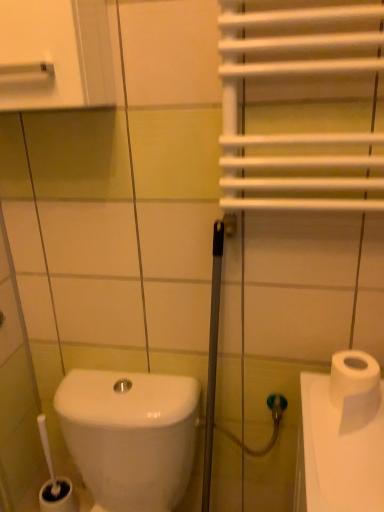
Question: Does white glossy toilet at lower left turn towards white glossy medicine cabinet at upper left?

Choices:
 (A) yes
 (B) no

Answer: (B)

Question: From a real-world perspective, is white glossy toilet at lower left positioned over white glossy medicine cabinet at upper left based on gravity?

Choices:
 (A) yes
 (B) no

Answer: (B)

Question: Does white glossy toilet at lower left have a lesser height compared to white glossy medicine cabinet at upper left?

Choices:
 (A) yes
 (B) no

Answer: (B)

Question: From the image's perspective, is white glossy toilet at lower left on top of white glossy medicine cabinet at upper left?

Choices:
 (A) yes
 (B) no

Answer: (B)

Question: Is white glossy toilet at lower left looking in the opposite direction of white glossy medicine cabinet at upper left?

Choices:
 (A) no
 (B) yes

Answer: (A)

Question: Is white glossy toilet at lower left positioned far away from white glossy medicine cabinet at upper left?

Choices:
 (A) yes
 (B) no

Answer: (B)

Question: Is white glossy toilet at lower left outside white matte toilet paper at right?

Choices:
 (A) yes
 (B) no

Answer: (A)

Question: Is white glossy toilet at lower left facing away from white matte toilet paper at right?

Choices:
 (A) yes
 (B) no

Answer: (B)

Question: Is white glossy toilet at lower left facing towards white matte toilet paper at right?

Choices:
 (A) yes
 (B) no

Answer: (B)

Question: From a real-world perspective, is white glossy toilet at lower left positioned over white matte toilet paper at right based on gravity?

Choices:
 (A) no
 (B) yes

Answer: (A)

Question: Considering the relative sizes of white glossy toilet at lower left and white matte toilet paper at right in the image provided, is white glossy toilet at lower left smaller than white matte toilet paper at right?

Choices:
 (A) no
 (B) yes

Answer: (A)

Question: Considering the relative sizes of white glossy toilet at lower left and white matte toilet paper at right in the image provided, is white glossy toilet at lower left wider than white matte toilet paper at right?

Choices:
 (A) yes
 (B) no

Answer: (A)

Question: Considering the relative positions of white matte toilet paper at right and white glossy medicine cabinet at upper left in the image provided, is white matte toilet paper at right behind white glossy medicine cabinet at upper left?

Choices:
 (A) no
 (B) yes

Answer: (B)